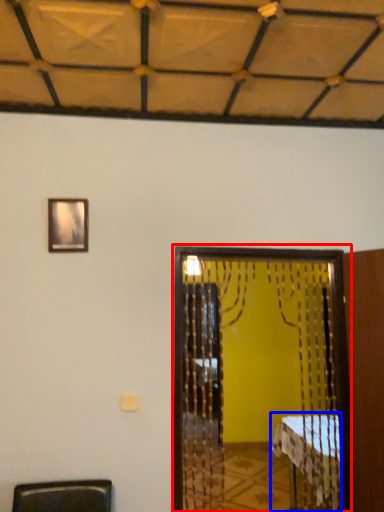
Question: Which object is closer to the camera taking this photo, screen door (highlighted by a red box) or table (highlighted by a blue box)?

Choices:
 (A) screen door
 (B) table

Answer: (A)